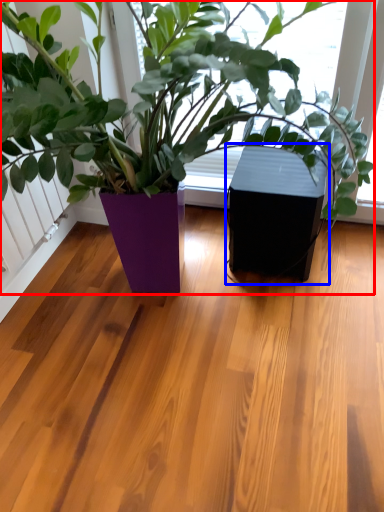
Question: Which of the following is the farthest to the observer, houseplant (highlighted by a red box) or window box (highlighted by a blue box)?

Choices:
 (A) houseplant
 (B) window box

Answer: (B)